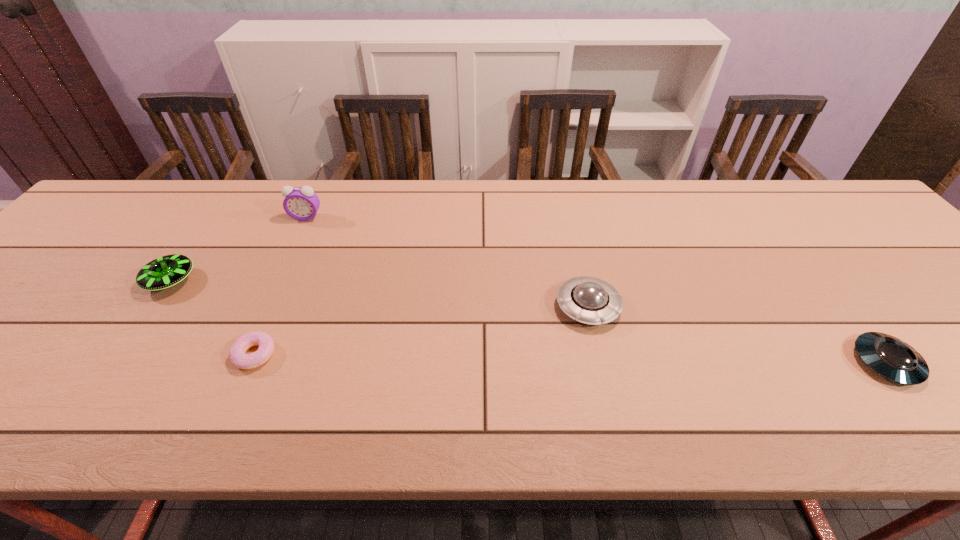
Identify the location of the second closest saucer to the leftmost saucer. (888, 356).

This screenshot has width=960, height=540. I want to click on vacant space that satisfies the following two spatial constraints: 1. on the face of the shortest saucer; 2. on the right side of the tallest object, so click(240, 362).

At what (x,y) coordinates should I click in order to perform the action: click on blank space that satisfies the following two spatial constraints: 1. on the front side of the leftmost object; 2. on the left side of the second object from right to left. Please return your answer as a coordinate pair (x, y). Looking at the image, I should click on (154, 307).

The image size is (960, 540). What are the coordinates of `free spot that satisfies the following two spatial constraints: 1. on the face of the farthest object; 2. on the left side of the second saucer from right to left` in the screenshot? It's located at 265,307.

Find the location of a particular element. Image resolution: width=960 pixels, height=540 pixels. blank space that satisfies the following two spatial constraints: 1. on the face of the farthest object; 2. on the left side of the shortest saucer is located at coordinates (240, 362).